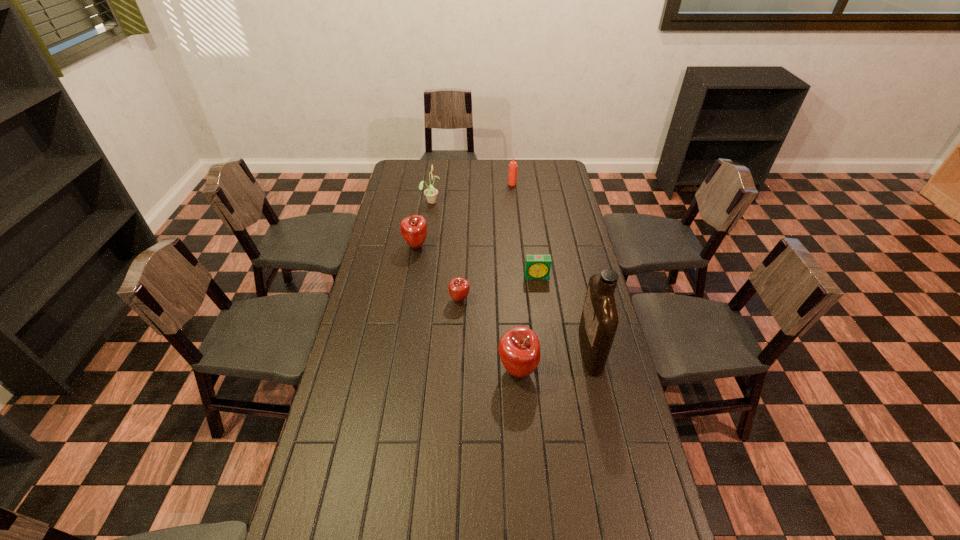
The width and height of the screenshot is (960, 540). In order to click on blank space that satisfies the following two spatial constraints: 1. on the front-facing side of the sunflower; 2. on the left side of the rightmost apple in this screenshot , I will do click(407, 370).

Where is `blank space that satisfies the following two spatial constraints: 1. on the back side of the farthest object; 2. on the left side of the rightmost apple`? Image resolution: width=960 pixels, height=540 pixels. blank space that satisfies the following two spatial constraints: 1. on the back side of the farthest object; 2. on the left side of the rightmost apple is located at coordinates (504, 184).

Locate an element on the screen. The height and width of the screenshot is (540, 960). vacant space that satisfies the following two spatial constraints: 1. on the back side of the rightmost apple; 2. on the front-facing side of the sunflower is located at coordinates click(505, 201).